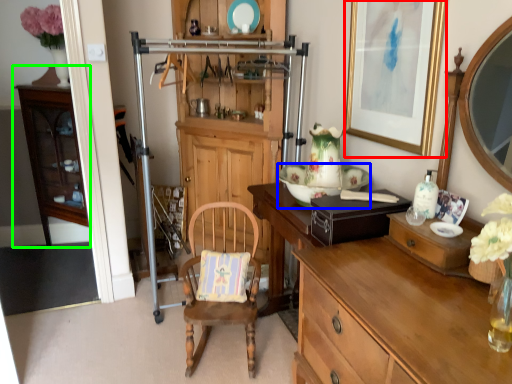
Question: Which is nearer to the picture frame (highlighted by a red box)? plate (highlighted by a blue box) or cabinetry (highlighted by a green box).

Choices:
 (A) plate
 (B) cabinetry

Answer: (A)